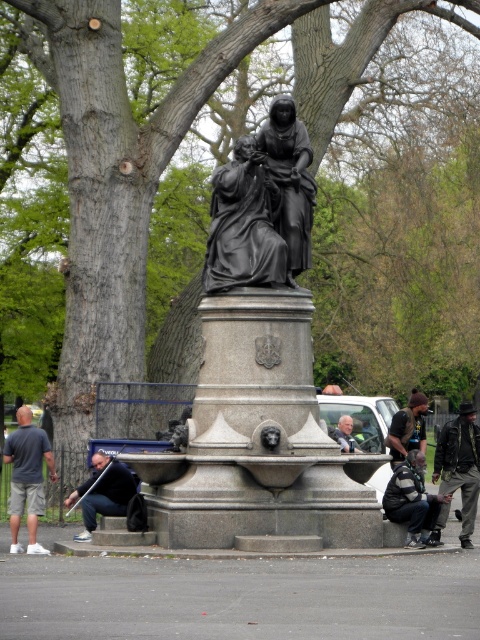
You are standing in the public space and see the statue with its pedestal and the tree. There is also a leather jacket at lower right. Where exactly is the leather jacket positioned relative to the statue and the tree?

The leather jacket at lower right is located at point coordinates (459, 465) relative to the image frame, placing it near the lower right corner, closer to the tree than the statue.

You are a photographer trying to capture a clear shot of the polished bronze statue at center without the dark gray leather jacket at lower right blocking the view. Based on their sizes, is there a chance the jacket could obscure the statue in the photo?

The polished bronze statue at center might be wider than dark gray leather jacket at lower right, so there is a possibility the jacket could partially block the statue if positioned too close. Adjust your angle to ensure the statue remains fully visible.